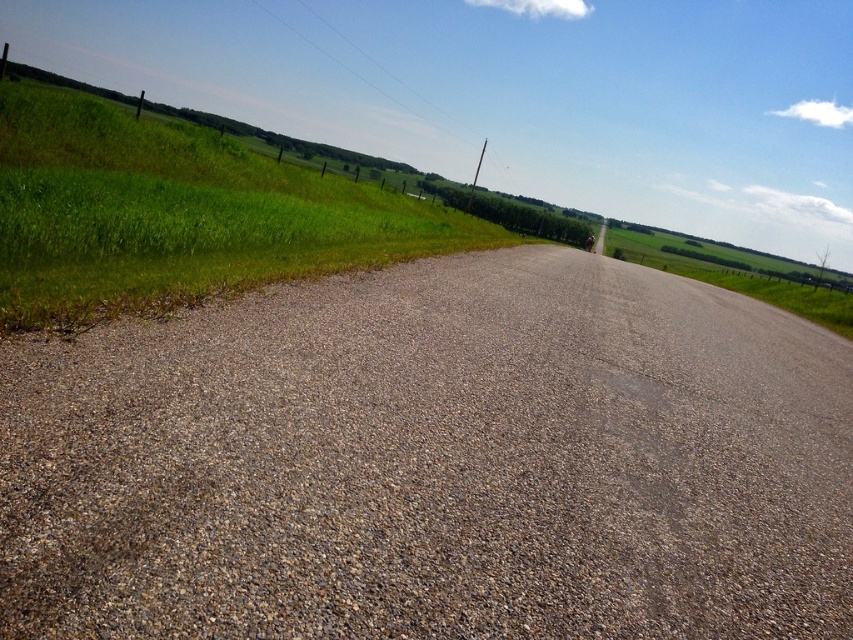
The width and height of the screenshot is (853, 640). Identify the location of gray gravel at center. (434, 461).

Between gray gravel at center and green grass at left, which one has more height?

green grass at left

Between point (447, 506) and point (206, 179), which one is positioned in front?

Point (447, 506) is more forward.

This screenshot has width=853, height=640. Identify the location of gray gravel at center. (434, 461).